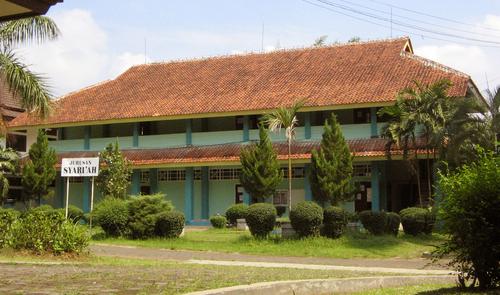
The image size is (500, 295). Identify the location of support beams. (192, 191), (135, 136), (87, 136), (188, 133), (245, 133), (311, 127), (378, 126), (376, 183).